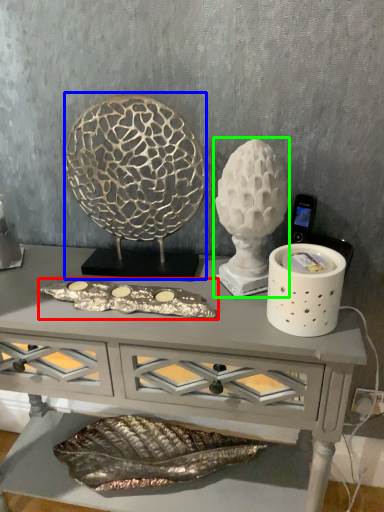
Question: Which object is the closest to the art (highlighted by a red box)? Choose among these: sculpture (highlighted by a blue box) or sculpture (highlighted by a green box).

Choices:
 (A) sculpture
 (B) sculpture

Answer: (B)